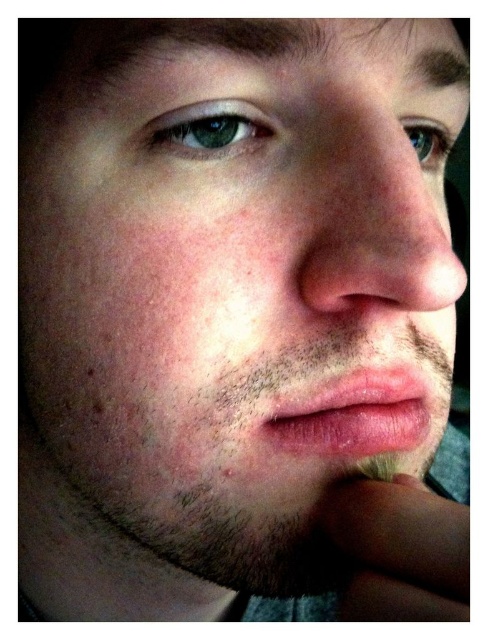
Measure the distance between dry matte lips at center and camera.

The distance of dry matte lips at center from camera is 29.77 centimeters.

Which is in front, point (365, 413) or point (236, 118)?

Point (236, 118) is more forward.

Identify the location of dry matte lips at center. coord(352,416).

I want to click on dry matte lips at center, so coord(352,416).

Can you confirm if pink smooth nose at center is positioned above green matte eye at upper left?

Incorrect, pink smooth nose at center is not positioned above green matte eye at upper left.

In order to click on pink smooth nose at center in this screenshot , I will do `click(387, 246)`.

Between point (209, 116) and point (414, 134), which one is positioned in front?

Point (209, 116) is more forward.

What do you see at coordinates (209, 129) in the screenshot? I see `green matte eye at upper left` at bounding box center [209, 129].

Where is `green matte eye at upper left`? green matte eye at upper left is located at coordinates (209, 129).